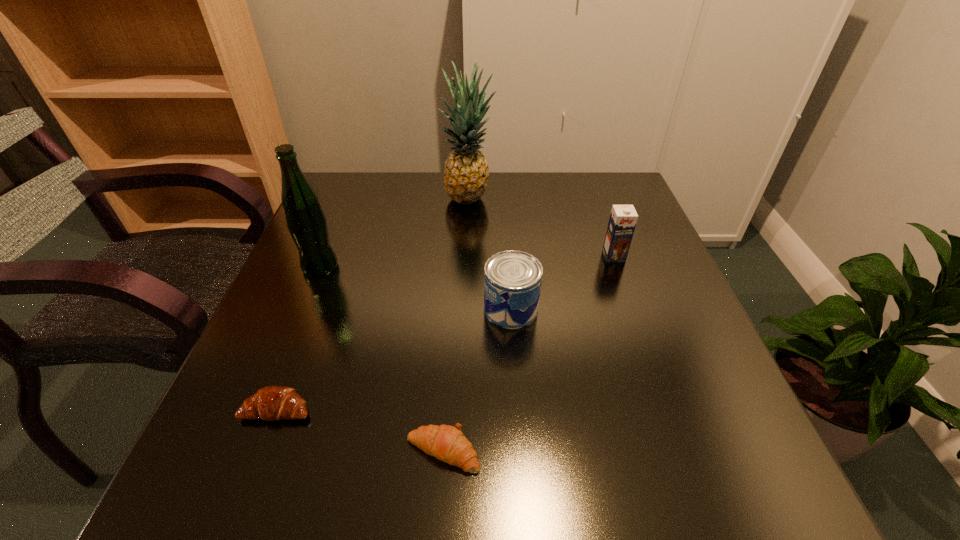
In the image, there is a desktop. Where is `vacant space at the near right corner`? vacant space at the near right corner is located at coordinates (732, 462).

At what (x,y) coordinates should I click in order to perform the action: click on vacant space in between the fifth shortest object and the third nearest object. Please return your answer as a coordinate pair (x, y). The height and width of the screenshot is (540, 960). Looking at the image, I should click on (416, 288).

Find the location of a particular element. The width and height of the screenshot is (960, 540). free space that is in between the nearest object and the beer bottle is located at coordinates (382, 359).

In order to click on blank region between the fourth shortest object and the nearer crescent roll in this screenshot , I will do `click(528, 354)`.

Identify the location of vacant space in between the nearer crescent roll and the farther crescent roll. (360, 430).

At what (x,y) coordinates should I click in order to perform the action: click on free space that is in between the can and the fifth farthest object. Please return your answer as a coordinate pair (x, y). Looking at the image, I should click on (395, 359).

At what (x,y) coordinates should I click in order to perform the action: click on vacant space that is in between the nearest object and the beer bottle. Please return your answer as a coordinate pair (x, y). Looking at the image, I should click on (382, 359).

In order to click on empty location between the farther crescent roll and the fourth tallest object in this screenshot , I will do `click(395, 359)`.

The height and width of the screenshot is (540, 960). I want to click on free spot between the fifth farthest object and the fifth shortest object, so click(x=299, y=338).

Identify the location of free point between the left crescent roll and the third nearest object. This screenshot has height=540, width=960. [x=395, y=359].